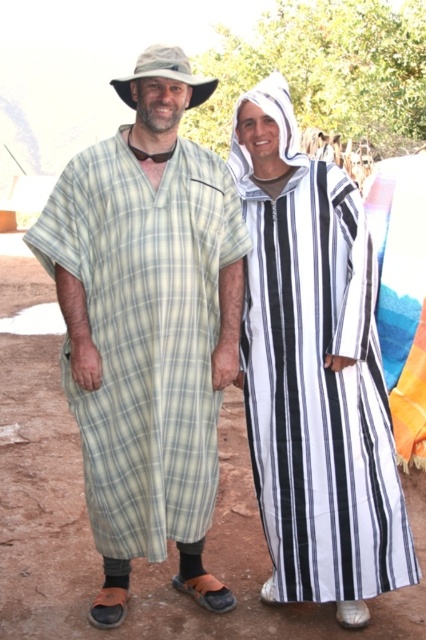
Between point (199, 168) and point (173, 54), which one is positioned in front?

Point (173, 54) is more forward.

Is light green plaid robe at center positioned at the back of camouflage fabric cowboy hat at upper center?

That is False.

What do you see at coordinates (147, 326) in the screenshot? The width and height of the screenshot is (426, 640). I see `light green plaid robe at center` at bounding box center [147, 326].

This screenshot has width=426, height=640. I want to click on light green plaid robe at center, so click(147, 326).

Does white striped robe at center have a larger size compared to camouflage fabric cowboy hat at upper center?

Yes.

Between point (308, 202) and point (195, 77), which one is positioned behind?

The point (308, 202) is more distant.

What do you see at coordinates (314, 372) in the screenshot? I see `white striped robe at center` at bounding box center [314, 372].

You are a GUI agent. You are given a task and a screenshot of the screen. Output one action in this format:
    pyautogui.click(x=<x>, y=<y>)
    Task: Click on the white striped robe at center
    This screenshot has width=426, height=640.
    Given the screenshot: What is the action you would take?
    pyautogui.click(x=314, y=372)

Does light green plaid robe at center lie in front of white striped robe at center?

Yes, it is.

Can you confirm if light green plaid robe at center is wider than white striped robe at center?

Yes, light green plaid robe at center is wider than white striped robe at center.

Locate an element on the screen. light green plaid robe at center is located at coordinates (147, 326).